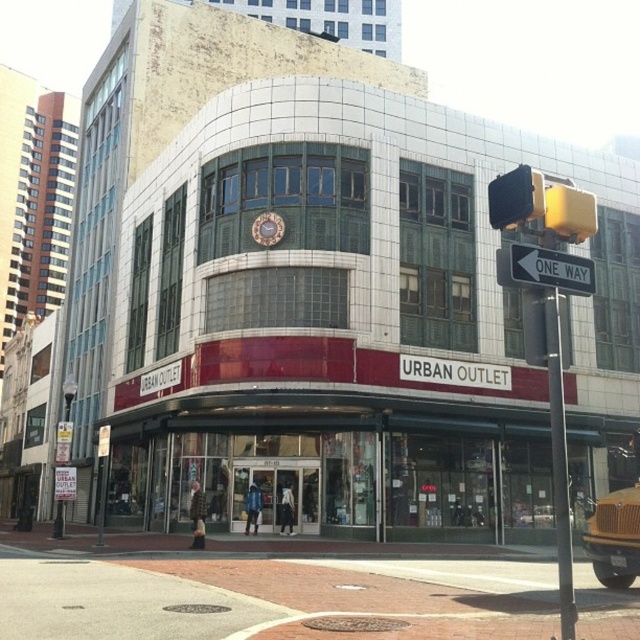
The image size is (640, 640). In order to click on yellow plastic traffic light at upper right in this screenshot , I will do `click(540, 205)`.

From the picture: Does yellow plastic traffic light at upper right have a greater height compared to black plastic traffic light at upper right?

Yes.

Who is more distant from viewer, (586, 228) or (506, 198)?

The point (506, 198) is behind.

Where is `yellow plastic traffic light at upper right`? The width and height of the screenshot is (640, 640). yellow plastic traffic light at upper right is located at coordinates (540, 205).

This screenshot has width=640, height=640. Describe the element at coordinates (616, 532) in the screenshot. I see `yellow metallic taxi at lower right` at that location.

Is the position of yellow metallic taxi at lower right more distant than that of black plastic traffic light at upper right?

Yes, it is.

Is point (604, 515) positioned after point (541, 208)?

Yes.

Where is `yellow metallic taxi at lower right`? This screenshot has width=640, height=640. yellow metallic taxi at lower right is located at coordinates (616, 532).

Is point (564, 275) behind point (540, 173)?

No, it is in front of (540, 173).

Locate an element on the screen. Image resolution: width=640 pixels, height=640 pixels. white plastic street sign at upper center is located at coordinates (552, 269).

Between point (547, 284) and point (513, 227), which one is positioned in front?

Positioned in front is point (547, 284).

Find the location of `white plastic street sign at upper center`. white plastic street sign at upper center is located at coordinates (552, 269).